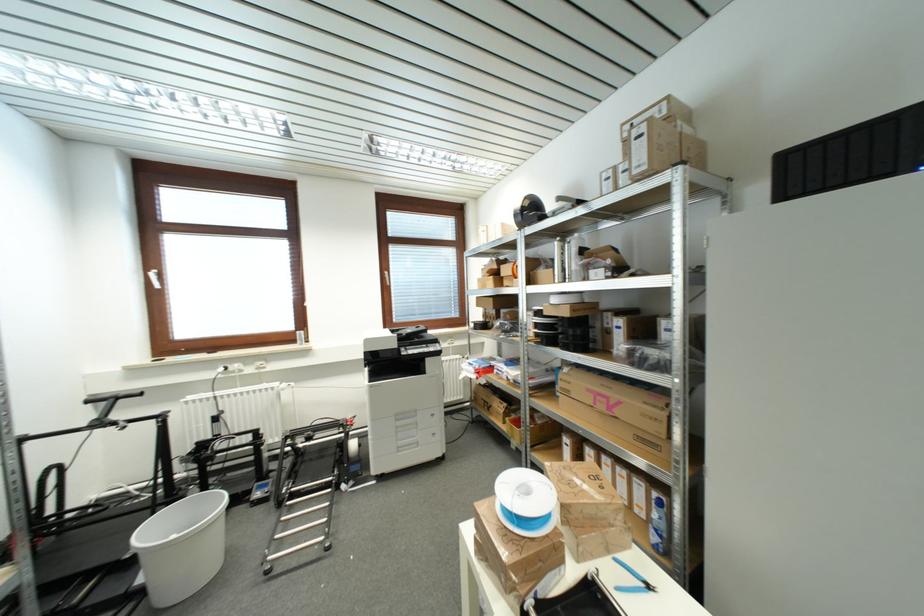
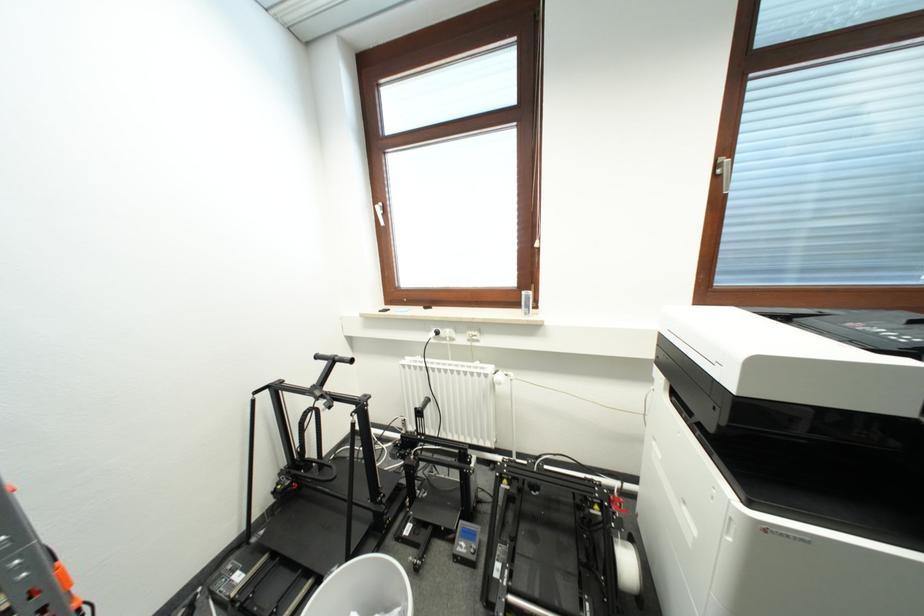
Find the pixel in the second image that matches [397,252] in the first image.

(766, 89)